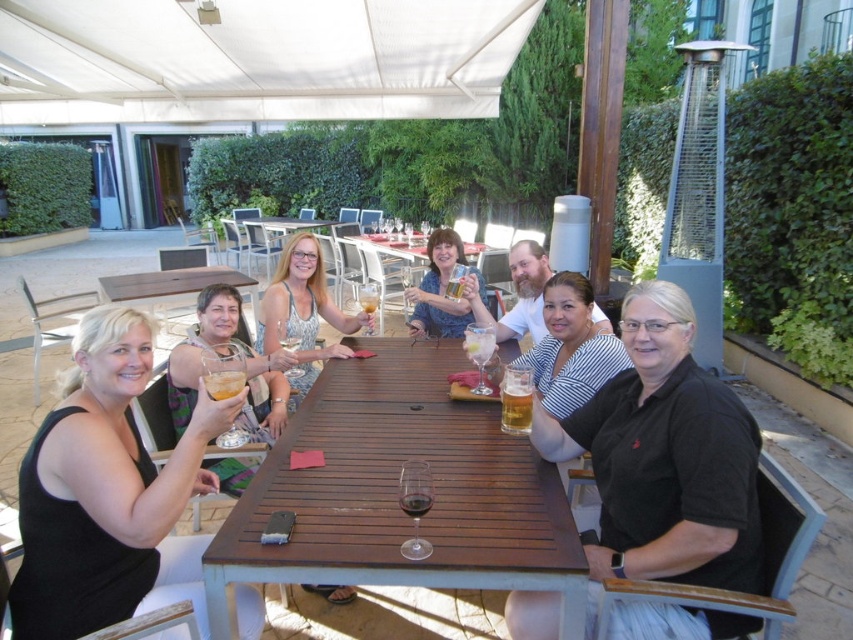
You are a waiter at this outdoor gathering. You need to place a new dessert plate on the table without covering any existing items. Considering the wooden table at center and the clear glass beer at center, which object should you prioritize moving to make space?

The wooden table at center is larger in size than the clear glass beer at center, so you should move the clear glass beer at center to make space for the dessert plate.

You are standing at the entrance of the patio and want to join the group sitting around the wooden table at center. Based on your position, is the table to your left or right side?

The wooden table at center is located at point coordinates which are not directly indicating left or right from your position. However, since you are at the entrance, the table is likely positioned in the central area of the patio, so it would be directly in front of you rather than to one side.